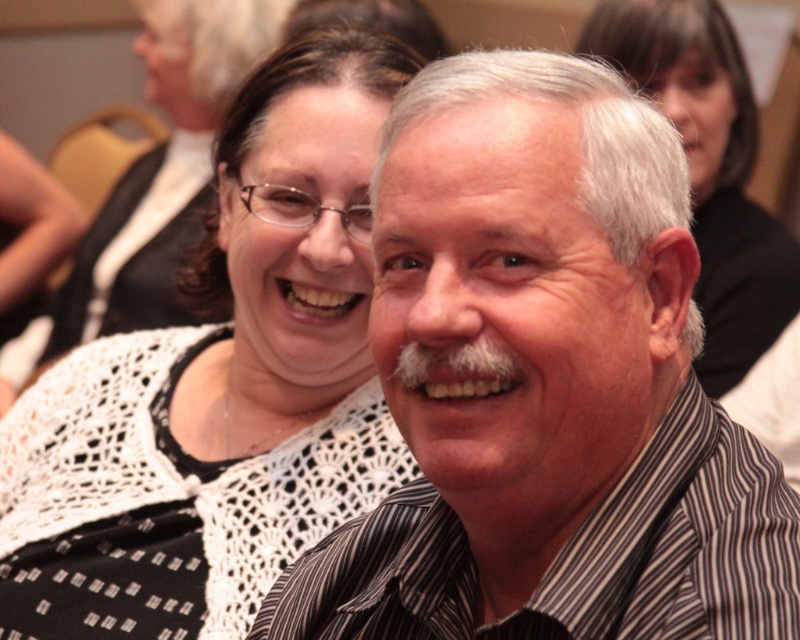
You are a photographer adjusting the camera focus. The white crochet sweater at upper center and the striped cotton shirt at center are both in the frame. Which item requires adjusting the focus to be closer to the camera?

The white crochet sweater at upper center requires adjusting the focus to be closer to the camera because it has a greater height compared to the striped cotton shirt at center, meaning it is closer to the viewer.

You are a photographer adjusting your camera settings to focus on the striped cotton shirt at center and the white lace top at upper center. Which object should you focus on first if you want to capture both clearly in the same frame?

The striped cotton shirt at center is positioned under the white lace top at upper center, so you should focus on the white lace top at upper center first to ensure both are in focus since it is closer to the camera.